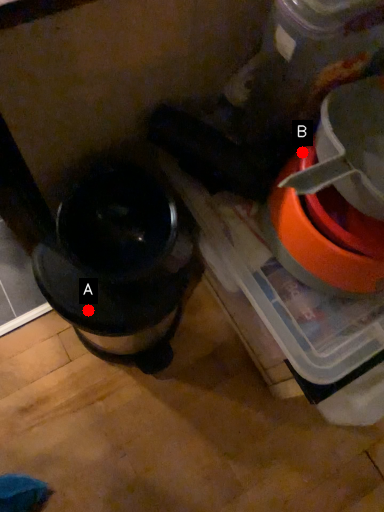
Question: Two points are circled on the image, labeled by A and B beside each circle. Which point is further to the camera?

Choices:
 (A) A is further
 (B) B is further

Answer: (A)